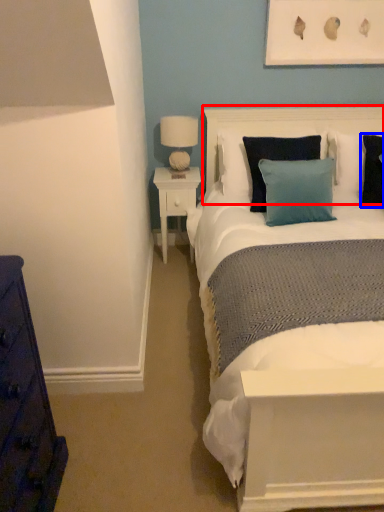
Question: Among these objects, which one is nearest to the camera, headboard (highlighted by a red box) or pillow (highlighted by a blue box)?

Choices:
 (A) headboard
 (B) pillow

Answer: (B)